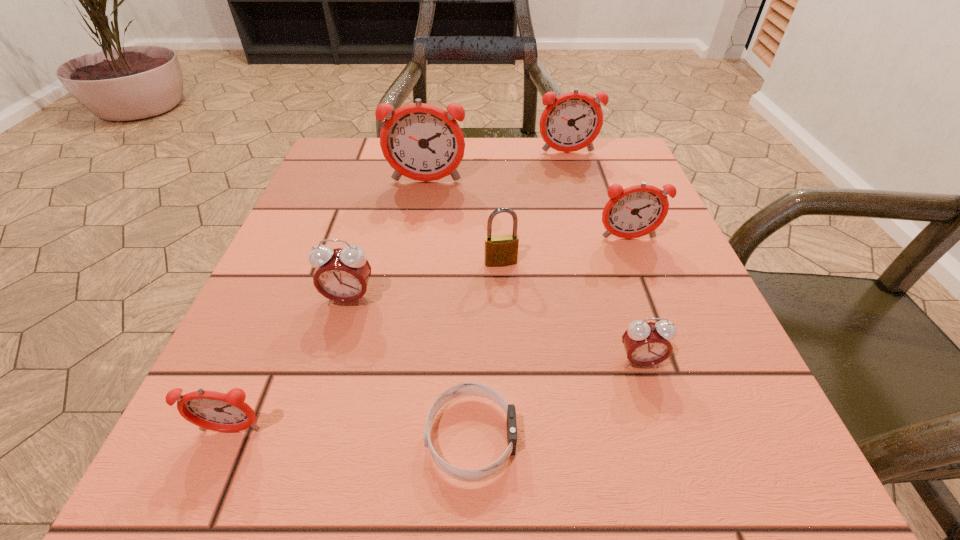
Identify the location of reddish-pink alarm clock object that ranks as the second closest to the leftmost object. The height and width of the screenshot is (540, 960). (636, 211).

Where is `reddish-pink alarm clock that is the third closest to the second farthest object`? The width and height of the screenshot is (960, 540). reddish-pink alarm clock that is the third closest to the second farthest object is located at coordinates (212, 410).

Find the location of a particular element. Image resolution: width=960 pixels, height=540 pixels. blank area in the image that satisfies the following two spatial constraints: 1. on the clock face of the third nearest object; 2. on the outer surface of the shortest object is located at coordinates (663, 437).